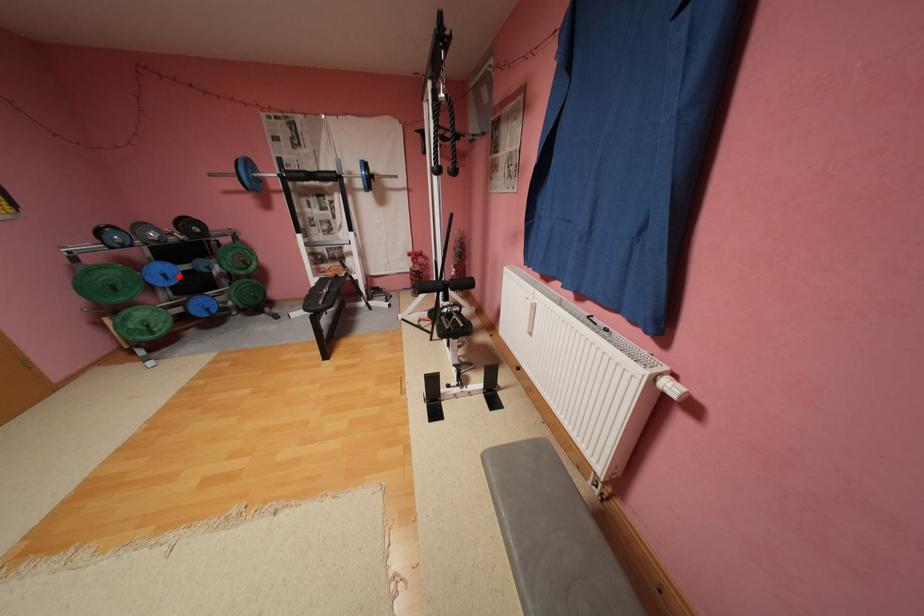
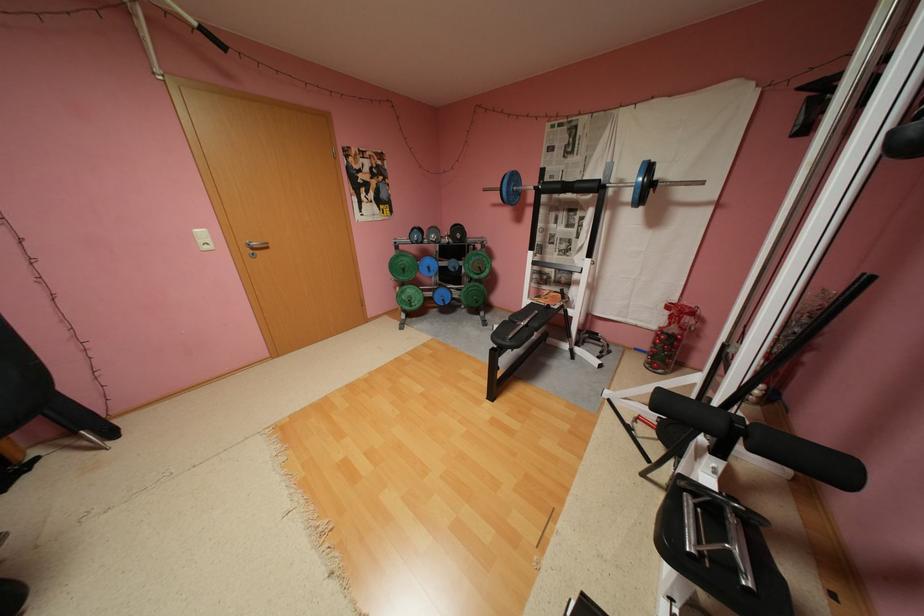
Question: I am providing you with two images of the same scene from different viewpoints. Image1 has a red point marked. In image2, the corresponding 3D location appears at what relative position? Reply with the corresponding letter.

Choices:
 (A) Closer
 (B) Farther

Answer: (A)